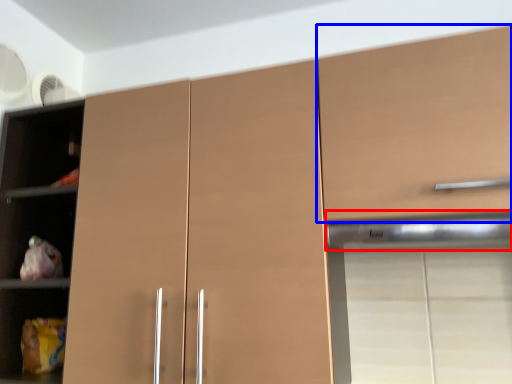
Question: Which point is further to the camera, exhaust hood (highlighted by a red box) or cabinetry (highlighted by a blue box)?

Choices:
 (A) exhaust hood
 (B) cabinetry

Answer: (A)